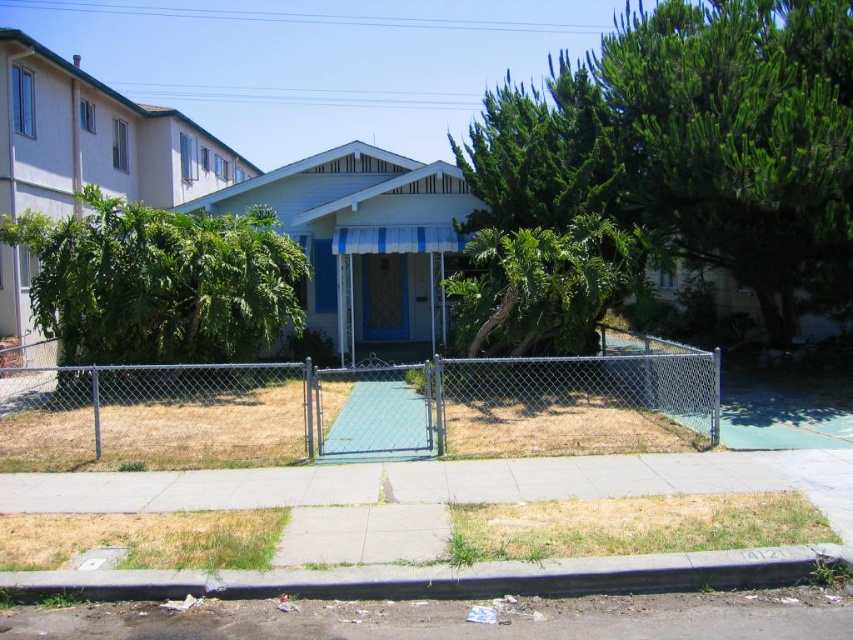
Question: Is chain link fence at center thinner than gray concrete curb at lower center?

Choices:
 (A) yes
 (B) no

Answer: (B)

Question: Does chain link fence at center appear on the right side of gray concrete curb at lower center?

Choices:
 (A) yes
 (B) no

Answer: (A)

Question: Can you confirm if chain link fence at center is positioned below gray concrete curb at lower center?

Choices:
 (A) no
 (B) yes

Answer: (A)

Question: Which object appears closest to the camera in this image?

Choices:
 (A) chain link fence at center
 (B) gray concrete curb at lower center

Answer: (B)